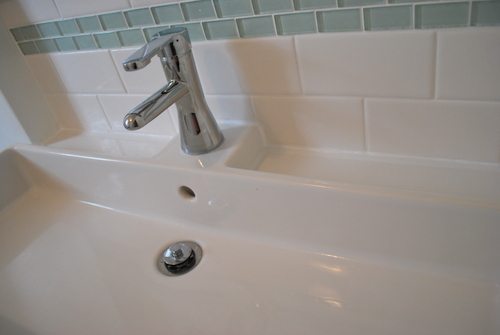
The image size is (500, 335). I want to click on top of sink stopper, so pos(173,244), pos(192,248).